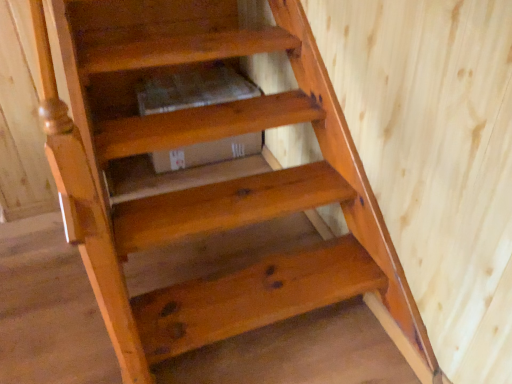
Locate an element on the screen. The image size is (512, 384). natural wood stair at center, the 1th stairwell when ordered from top to bottom is located at coordinates (225, 205).

Describe the element at coordinates (225, 205) in the screenshot. I see `natural wood stair at center, the 1th stairwell when ordered from top to bottom` at that location.

You are a GUI agent. You are given a task and a screenshot of the screen. Output one action in this format:
    pyautogui.click(x=<x>, y=<y>)
    Task: Click on the natural wood stair at lower center, the first stairwell when ordered from bottom to top
    This screenshot has width=512, height=384.
    Given the screenshot: What is the action you would take?
    pyautogui.click(x=253, y=297)

Describe the element at coordinates (253, 297) in the screenshot. I see `natural wood stair at lower center, the first stairwell when ordered from bottom to top` at that location.

The height and width of the screenshot is (384, 512). In order to click on natural wood stair at center, the 1th stairwell when ordered from top to bottom in this screenshot , I will do `click(225, 205)`.

Does natural wood stair at lower center, the first stairwell when ordered from bottom to top, appear on the left side of natural wood stair at center, the 2th stairwell positioned from the bottom?

Incorrect, natural wood stair at lower center, the first stairwell when ordered from bottom to top, is not on the left side of natural wood stair at center, the 2th stairwell positioned from the bottom.

Considering their positions, is natural wood stair at lower center, the first stairwell when ordered from bottom to top, located in front of or behind natural wood stair at center, the 1th stairwell when ordered from top to bottom?

Clearly, natural wood stair at lower center, the first stairwell when ordered from bottom to top, is in front of natural wood stair at center, the 1th stairwell when ordered from top to bottom.

Which point is more forward, (227, 321) or (138, 211)?

The point (227, 321) is more forward.

From the image's perspective, which object appears higher, natural wood stair at lower center, the first stairwell when ordered from bottom to top, or natural wood stair at center, the 2th stairwell positioned from the bottom?

natural wood stair at center, the 2th stairwell positioned from the bottom.

From a real-world perspective, does natural wood stair at lower center, the first stairwell when ordered from bottom to top, stand above natural wood stair at center, the 1th stairwell when ordered from top to bottom?

No, from a real-world perspective, natural wood stair at lower center, the first stairwell when ordered from bottom to top, is not over natural wood stair at center, the 1th stairwell when ordered from top to bottom

Based on the photo, is natural wood stair at lower center, which ranks as the 2th stairwell in top-to-bottom order, wider than natural wood stair at center, the 2th stairwell positioned from the bottom?

Correct, the width of natural wood stair at lower center, which ranks as the 2th stairwell in top-to-bottom order, exceeds that of natural wood stair at center, the 2th stairwell positioned from the bottom.

Between natural wood stair at lower center, the first stairwell when ordered from bottom to top, and natural wood stair at center, the 1th stairwell when ordered from top to bottom, which one has less height?

natural wood stair at center, the 1th stairwell when ordered from top to bottom.

Which of these two, natural wood stair at lower center, which ranks as the 2th stairwell in top-to-bottom order, or natural wood stair at center, the 2th stairwell positioned from the bottom, is smaller?

natural wood stair at center, the 2th stairwell positioned from the bottom.

Is natural wood stair at lower center, the first stairwell when ordered from bottom to top, not inside natural wood stair at center, the 1th stairwell when ordered from top to bottom?

natural wood stair at lower center, the first stairwell when ordered from bottom to top, lies outside natural wood stair at center, the 1th stairwell when ordered from top to bottom,'s area.

Is natural wood stair at lower center, the first stairwell when ordered from bottom to top, directly adjacent to natural wood stair at center, the 2th stairwell positioned from the bottom?

No, natural wood stair at lower center, the first stairwell when ordered from bottom to top, is not next to natural wood stair at center, the 2th stairwell positioned from the bottom.

Is natural wood stair at lower center, which ranks as the 2th stairwell in top-to-bottom order, turned away from natural wood stair at center, the 1th stairwell when ordered from top to bottom?

No, natural wood stair at lower center, which ranks as the 2th stairwell in top-to-bottom order,'s orientation is not away from natural wood stair at center, the 1th stairwell when ordered from top to bottom.

How many degrees apart are the facing directions of natural wood stair at lower center, the first stairwell when ordered from bottom to top, and natural wood stair at center, the 1th stairwell when ordered from top to bottom?

The angular difference between natural wood stair at lower center, the first stairwell when ordered from bottom to top, and natural wood stair at center, the 1th stairwell when ordered from top to bottom, is 0.00143 degrees.

How far apart are natural wood stair at lower center, the first stairwell when ordered from bottom to top, and natural wood stair at center, the 2th stairwell positioned from the bottom?

natural wood stair at lower center, the first stairwell when ordered from bottom to top, is 9.26 inches away from natural wood stair at center, the 2th stairwell positioned from the bottom.

The image size is (512, 384). Find the location of `stairwell above the natural wood stair at lower center, which ranks as the 2th stairwell in top-to-bottom order (from a real-world perspective)`. stairwell above the natural wood stair at lower center, which ranks as the 2th stairwell in top-to-bottom order (from a real-world perspective) is located at coordinates (225, 205).

In the image, is natural wood stair at center, the 2th stairwell positioned from the bottom, on the left side or the right side of natural wood stair at lower center, the first stairwell when ordered from bottom to top?

natural wood stair at center, the 2th stairwell positioned from the bottom, is positioned on natural wood stair at lower center, the first stairwell when ordered from bottom to top,'s left side.

Which object is closer to the camera taking this photo, natural wood stair at center, the 1th stairwell when ordered from top to bottom, or natural wood stair at lower center, the first stairwell when ordered from bottom to top?

natural wood stair at lower center, the first stairwell when ordered from bottom to top.

Does point (312, 170) come behind point (200, 302)?

Yes, point (312, 170) is behind point (200, 302).

Consider the image. From the image's perspective, is natural wood stair at center, the 2th stairwell positioned from the bottom, over natural wood stair at lower center, which ranks as the 2th stairwell in top-to-bottom order?

Correct, natural wood stair at center, the 2th stairwell positioned from the bottom, appears higher than natural wood stair at lower center, which ranks as the 2th stairwell in top-to-bottom order, in the image.

From a real-world perspective, is natural wood stair at center, the 1th stairwell when ordered from top to bottom, below natural wood stair at lower center, the first stairwell when ordered from bottom to top?

No.

Considering the relative sizes of natural wood stair at center, the 1th stairwell when ordered from top to bottom, and natural wood stair at lower center, the first stairwell when ordered from bottom to top, in the image provided, is natural wood stair at center, the 1th stairwell when ordered from top to bottom, wider than natural wood stair at lower center, the first stairwell when ordered from bottom to top,?

Incorrect, the width of natural wood stair at center, the 1th stairwell when ordered from top to bottom, does not surpass that of natural wood stair at lower center, the first stairwell when ordered from bottom to top.

Considering the sizes of objects natural wood stair at center, the 1th stairwell when ordered from top to bottom, and natural wood stair at lower center, the first stairwell when ordered from bottom to top, in the image provided, who is shorter, natural wood stair at center, the 1th stairwell when ordered from top to bottom, or natural wood stair at lower center, the first stairwell when ordered from bottom to top,?

natural wood stair at center, the 1th stairwell when ordered from top to bottom.

Is natural wood stair at center, the 1th stairwell when ordered from top to bottom, smaller than natural wood stair at lower center, which ranks as the 2th stairwell in top-to-bottom order?

Yes, natural wood stair at center, the 1th stairwell when ordered from top to bottom, is smaller than natural wood stair at lower center, which ranks as the 2th stairwell in top-to-bottom order.

Is natural wood stair at center, the 2th stairwell positioned from the bottom, not inside natural wood stair at lower center, the first stairwell when ordered from bottom to top?

Yes, natural wood stair at center, the 2th stairwell positioned from the bottom, is outside of natural wood stair at lower center, the first stairwell when ordered from bottom to top.

Are natural wood stair at center, the 1th stairwell when ordered from top to bottom, and natural wood stair at lower center, which ranks as the 2th stairwell in top-to-bottom order, located far from each other?

That's not correct — natural wood stair at center, the 1th stairwell when ordered from top to bottom, is a little close to natural wood stair at lower center, which ranks as the 2th stairwell in top-to-bottom order.

Could you tell me if natural wood stair at center, the 2th stairwell positioned from the bottom, is facing natural wood stair at lower center, which ranks as the 2th stairwell in top-to-bottom order?

No, natural wood stair at center, the 2th stairwell positioned from the bottom, is not facing towards natural wood stair at lower center, which ranks as the 2th stairwell in top-to-bottom order.

Identify the location of stairwell located above the natural wood stair at lower center, the first stairwell when ordered from bottom to top (from the image's perspective). This screenshot has height=384, width=512. (225, 205).

Where is `stairwell on the right side of natural wood stair at center, the 2th stairwell positioned from the bottom`? This screenshot has width=512, height=384. stairwell on the right side of natural wood stair at center, the 2th stairwell positioned from the bottom is located at coordinates (253, 297).

You are a GUI agent. You are given a task and a screenshot of the screen. Output one action in this format:
    pyautogui.click(x=<x>, y=<y>)
    Task: Click on the stairwell to the left of natural wood stair at lower center, which ranks as the 2th stairwell in top-to-bottom order
    This screenshot has height=384, width=512.
    Given the screenshot: What is the action you would take?
    click(225, 205)